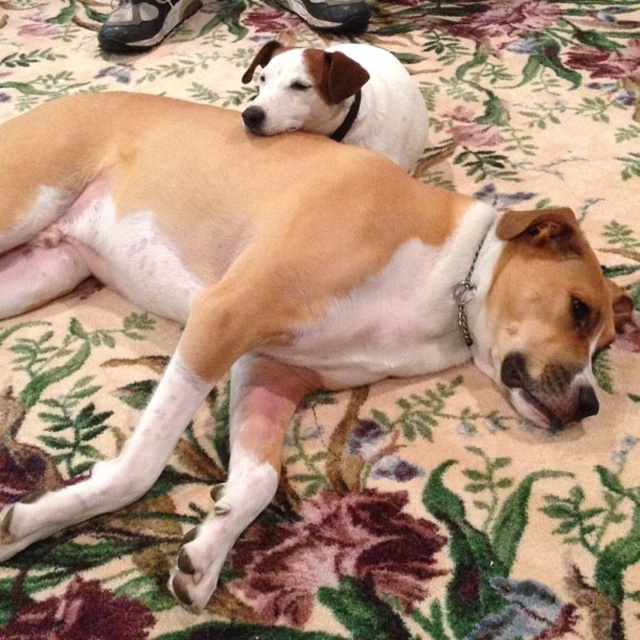
Looking at this image, you are a dog owner who wants to place a new toy between the black fabric shoe at upper left and the black leather neckband at upper center. Which object should you place the toy closer to if you want it to be near the smaller item?

The black leather neckband at upper center is smaller than the black fabric shoe at upper left, so placing the toy closer to the black leather neckband at upper center would position it near the smaller item.

You are a photographer setting up a shoot in the scene described. You need to place a small prop between the black leather shoe at upper center and the black leather neckband at upper center. Which object should the prop be closer to if you want it to be visually balanced based on their heights?

The black leather shoe at upper center is taller than the black leather neckband at upper center. To achieve visual balance, the prop should be placed closer to the black leather neckband at upper center since it is shorter, compensating for the height difference between the two objects.